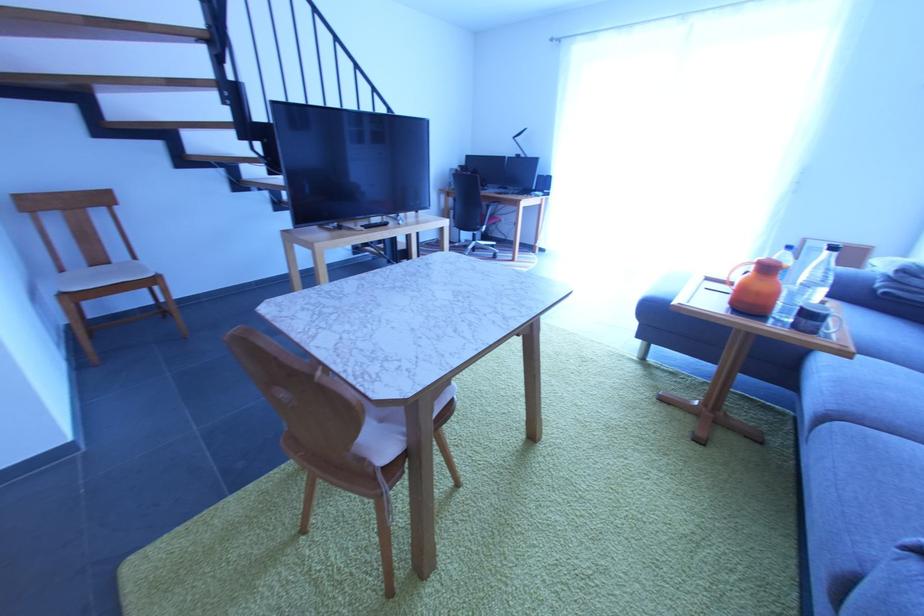
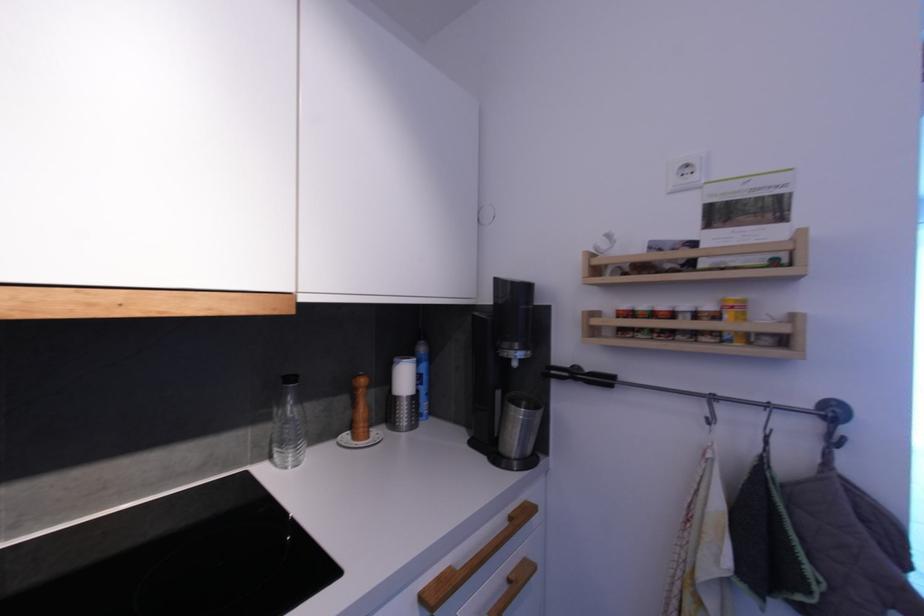
Question: The images are taken continuously from a first-person perspective. In which direction are you moving?

Choices:
 (A) Left
 (B) Right
 (C) Forward
 (D) Backward

Answer: (A)